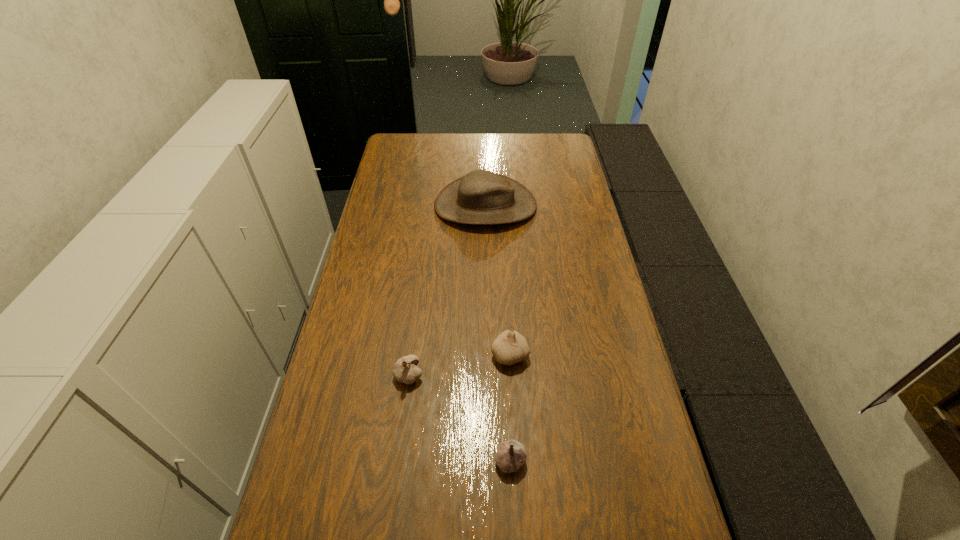
This screenshot has width=960, height=540. Find the location of `vacant area that lies between the leftmost garlic and the nearest garlic`. vacant area that lies between the leftmost garlic and the nearest garlic is located at coordinates (460, 417).

The height and width of the screenshot is (540, 960). What are the coordinates of `vacant area between the cowboy hat and the nearest garlic` in the screenshot? It's located at (498, 333).

At what (x,y) coordinates should I click in order to perform the action: click on empty space between the nearest object and the leftmost garlic. Please return your answer as a coordinate pair (x, y). Looking at the image, I should click on (460, 417).

Find the location of `vacant area that lies between the cowboy hat and the leftmost garlic`. vacant area that lies between the cowboy hat and the leftmost garlic is located at coordinates [x=447, y=291].

You are a GUI agent. You are given a task and a screenshot of the screen. Output one action in this format:
    pyautogui.click(x=<x>, y=<y>)
    Task: Click on the vacant area that lies between the nearest garlic and the farthest object
    This screenshot has width=960, height=540.
    Given the screenshot: What is the action you would take?
    pyautogui.click(x=498, y=333)

You are a GUI agent. You are given a task and a screenshot of the screen. Output one action in this format:
    pyautogui.click(x=<x>, y=<y>)
    Task: Click on the empty location between the leftmost garlic and the farthest object
    The height and width of the screenshot is (540, 960).
    Given the screenshot: What is the action you would take?
    pyautogui.click(x=447, y=291)

The height and width of the screenshot is (540, 960). Identify the location of the closest object relative to the tallest object. (510, 347).

At what (x,y) coordinates should I click in order to perform the action: click on the third closest object to the nearest garlic. Please return your answer as a coordinate pair (x, y). This screenshot has height=540, width=960. Looking at the image, I should click on (481, 197).

I want to click on the second closest garlic to the nearest garlic, so click(x=405, y=370).

Locate an element on the screen. the closest garlic relative to the nearest object is located at coordinates pyautogui.click(x=510, y=347).